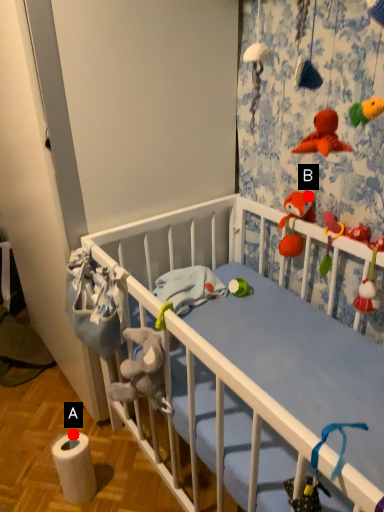
Question: Two points are circled on the image, labeled by A and B beside each circle. Which point appears closest to the camera in this image?

Choices:
 (A) A is closer
 (B) B is closer

Answer: (B)